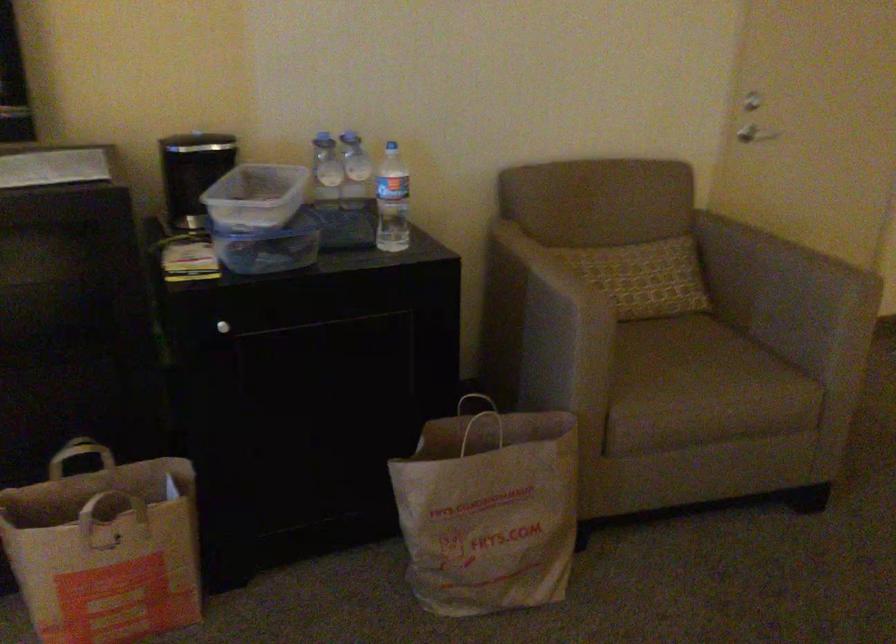
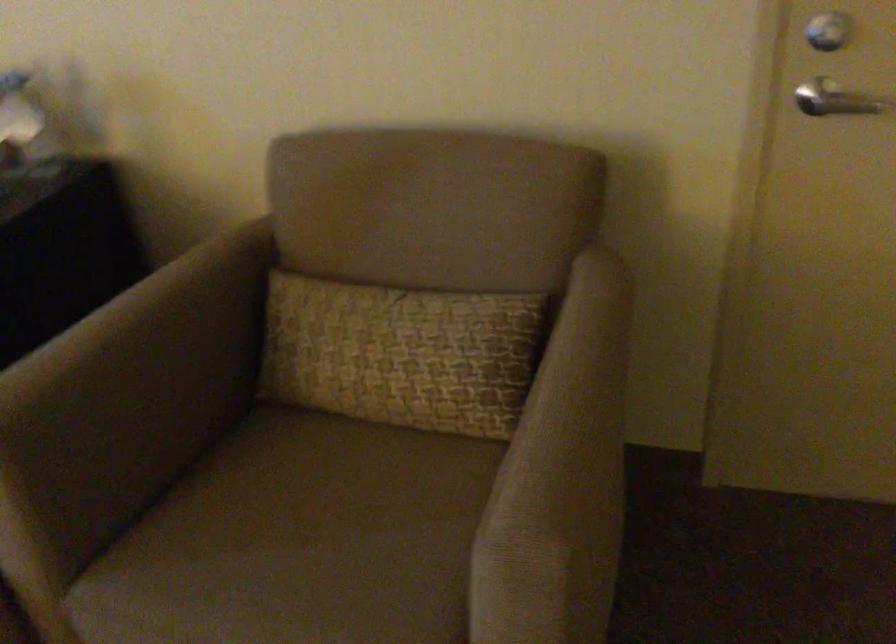
Find the pixel in the second image that matches point (820, 250) in the first image.

(581, 424)